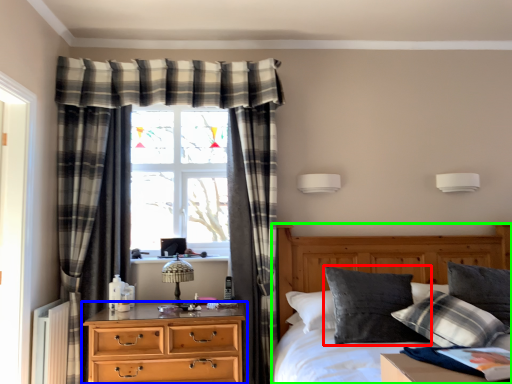
Question: Which object is positioned closest to pillow (highlighted by a red box)? Select from chest of drawers (highlighted by a blue box) and bed (highlighted by a green box).

Choices:
 (A) chest of drawers
 (B) bed

Answer: (B)